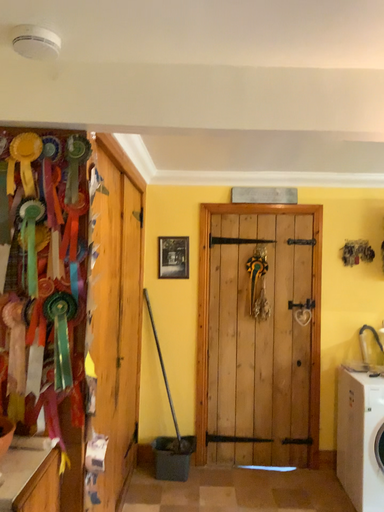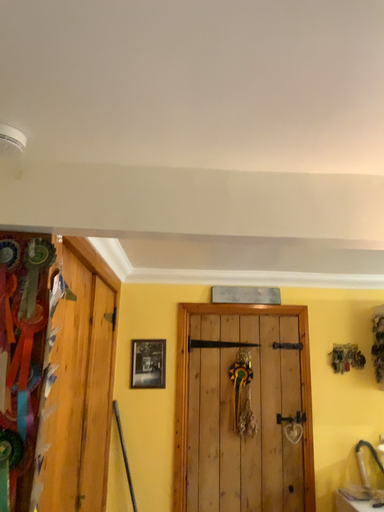
Question: How did the camera likely rotate when shooting the video?

Choices:
 (A) rotated downward
 (B) rotated upward

Answer: (B)